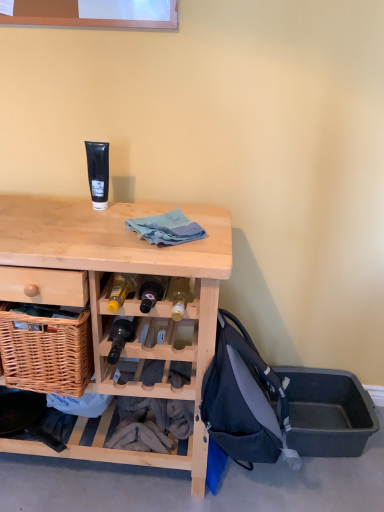
What do you see at coordinates (166, 228) in the screenshot?
I see `blue cotton cloth at center` at bounding box center [166, 228].

Measure the distance between point (x=96, y=298) and camera.

Point (x=96, y=298) and camera are 1.13 meters apart from each other.

Image resolution: width=384 pixels, height=512 pixels. I want to click on blue cotton cloth at center, so click(x=166, y=228).

Relative to gray plastic storage box at lower right, is blue cotton cloth at center in front or behind?

Visually, blue cotton cloth at center is located in front of gray plastic storage box at lower right.

Which of these two, blue cotton cloth at center or gray plastic storage box at lower right, stands shorter?

Standing shorter between the two is blue cotton cloth at center.

Which object is positioned more to the left, blue cotton cloth at center or gray plastic storage box at lower right?

blue cotton cloth at center is more to the left.

Who is taller, gray plastic storage box at lower right or black matte tube at upper center?

With more height is black matte tube at upper center.

Does gray plastic storage box at lower right touch black matte tube at upper center?

No, gray plastic storage box at lower right is not beside black matte tube at upper center.

Relative to black matte tube at upper center, is gray plastic storage box at lower right in front or behind?

gray plastic storage box at lower right is positioned farther from the viewer than black matte tube at upper center.

Which of these two, dark blue fabric backpack at lower right or black matte tube at upper center, is bigger?

With larger size is dark blue fabric backpack at lower right.

From the image's perspective, which object appears higher, dark blue fabric backpack at lower right or black matte tube at upper center?

black matte tube at upper center, from the image's perspective.

Which object is wider, dark blue fabric backpack at lower right or black matte tube at upper center?

dark blue fabric backpack at lower right is wider.

You are a GUI agent. You are given a task and a screenshot of the screen. Output one action in this format:
    pyautogui.click(x=<x>, y=<y>)
    Task: Click on the toiletry behind the dark blue fabric backpack at lower right
    
    Given the screenshot: What is the action you would take?
    pyautogui.click(x=98, y=173)

Does black matte tube at upper center appear on the left side of dark blue fabric backpack at lower right?

Yes, black matte tube at upper center is to the left of dark blue fabric backpack at lower right.

Which is behind, point (99, 207) or point (212, 362)?

Point (99, 207)

Does black matte tube at upper center have a larger size compared to dark blue fabric backpack at lower right?

No, black matte tube at upper center is not bigger than dark blue fabric backpack at lower right.

Is dark blue fabric backpack at lower right in front of or behind matte black bottle at center in the image?

Clearly, dark blue fabric backpack at lower right is in front of matte black bottle at center.

How many degrees apart are the facing directions of dark blue fabric backpack at lower right and matte black bottle at center?

dark blue fabric backpack at lower right and matte black bottle at center are facing 91.9 degrees away from each other.

From a real-world perspective, is dark blue fabric backpack at lower right physically located above or below matte black bottle at center?

In terms of real-world spatial position, dark blue fabric backpack at lower right is below matte black bottle at center.

Which of these two, dark blue fabric backpack at lower right or matte black bottle at center, is wider?

With larger width is dark blue fabric backpack at lower right.

From the picture: From the image's perspective, between matte black bottle at center and light wood desk at center, who is located below?

light wood desk at center.

Which is correct: matte black bottle at center is inside light wood desk at center, or outside of it?

matte black bottle at center is located inside light wood desk at center.

From a real-world perspective, is matte black bottle at center on top of light wood desk at center?

Yes.

Between point (256, 449) and point (332, 420), which one is positioned behind?

Point (332, 420)

From the image's perspective, is dark blue fabric backpack at lower right located above gray plastic storage box at lower right?

Indeed, from the image's perspective, dark blue fabric backpack at lower right is shown above gray plastic storage box at lower right.

From the picture: Are dark blue fabric backpack at lower right and gray plastic storage box at lower right far apart?

No, dark blue fabric backpack at lower right is not far away from gray plastic storage box at lower right.

Locate an element on the screen. storage box lying below the dark blue fabric backpack at lower right (from the image's perspective) is located at coordinates (327, 412).

At what (x,y) coordinates should I click in order to perform the action: click on clothing on the left of gray plastic storage box at lower right. Please return your answer as a coordinate pair (x, y). Looking at the image, I should click on (166, 228).

I want to click on storage box located on the right of black matte tube at upper center, so click(x=327, y=412).

Considering their positions, is dark blue fabric backpack at lower right positioned closer to gray plastic storage box at lower right than black matte tube at upper center?

dark blue fabric backpack at lower right.

Which object lies further to the anchor point dark blue fabric backpack at lower right, light wood desk at center or gray plastic storage box at lower right?

Based on the image, gray plastic storage box at lower right appears to be further to dark blue fabric backpack at lower right.

Considering their positions, is light wood desk at center positioned further to black matte tube at upper center than matte black bottle at center?

matte black bottle at center is further to black matte tube at upper center.

From the image, which object appears to be nearer to matte black bottle at center, blue cotton cloth at center or black matte tube at upper center?

blue cotton cloth at center is closer to matte black bottle at center.

Estimate the real-world distances between objects in this image. Which object is further from gray plastic storage box at lower right, blue cotton cloth at center or black matte tube at upper center?

The object further to gray plastic storage box at lower right is black matte tube at upper center.

Based on their spatial positions, is gray plastic storage box at lower right or black matte tube at upper center closer to light wood desk at center?

The object closer to light wood desk at center is black matte tube at upper center.

Estimate the real-world distances between objects in this image. Which object is closer to blue cotton cloth at center, light wood desk at center or dark blue fabric backpack at lower right?

light wood desk at center.

Which object lies nearer to the anchor point matte black bottle at center, black matte tube at upper center or gray plastic storage box at lower right?

black matte tube at upper center is positioned closer to the anchor matte black bottle at center.

I want to click on desk between black matte tube at upper center and dark blue fabric backpack at lower right in the vertical direction, so click(x=129, y=300).

Find the location of `backpack between blue cotton cloth at center and gray plastic storage box at lower right in the vertical direction`. backpack between blue cotton cloth at center and gray plastic storage box at lower right in the vertical direction is located at coordinates (244, 400).

You are a GUI agent. You are given a task and a screenshot of the screen. Output one action in this format:
    pyautogui.click(x=<x>, y=<y>)
    Task: Click on the clothing situated between matte black bottle at center and gray plastic storage box at lower right from left to right
    This screenshot has width=384, height=512.
    Given the screenshot: What is the action you would take?
    pyautogui.click(x=166, y=228)

Where is `bottle between light wood desk at center and dark blue fabric backpack at lower right from left to right`? bottle between light wood desk at center and dark blue fabric backpack at lower right from left to right is located at coordinates (120, 336).